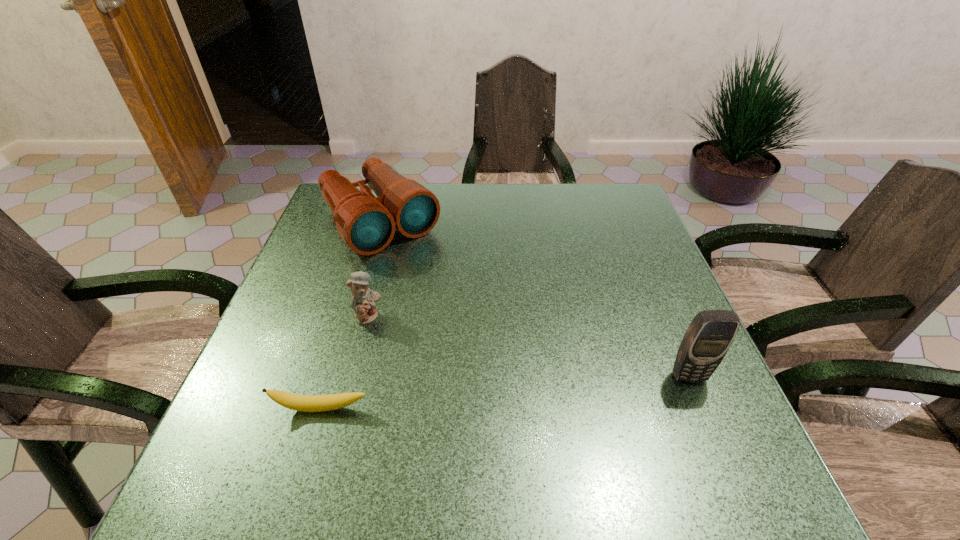
Find the location of a particular element. The height and width of the screenshot is (540, 960). vacant space located on the front-facing side of the second shortest object is located at coordinates [x=446, y=377].

This screenshot has height=540, width=960. What are the coordinates of `free region located 0.250m on the front-facing side of the second shortest object` in the screenshot? It's located at (461, 389).

Identify the location of vacant position located 0.110m through the lenses of the third shortest object. (429, 279).

Identify the location of free space located 0.340m through the lenses of the third shortest object. (482, 339).

Locate an element on the screen. The width and height of the screenshot is (960, 540). vacant space positioned 0.160m through the lenses of the third shortest object is located at coordinates (439, 291).

The image size is (960, 540). In order to click on object that is positioned at the far edge in this screenshot , I will do (367, 223).

I want to click on object positioned at the near edge, so click(305, 403).

Find the location of a particular element. The image size is (960, 540). banana situated at the left edge is located at coordinates (305, 403).

You are a GUI agent. You are given a task and a screenshot of the screen. Output one action in this format:
    pyautogui.click(x=<x>, y=<y>)
    Task: Click on the binoculars that is at the left edge
    
    Given the screenshot: What is the action you would take?
    pyautogui.click(x=367, y=223)

Find the location of `object present at the right edge`. object present at the right edge is located at coordinates (705, 343).